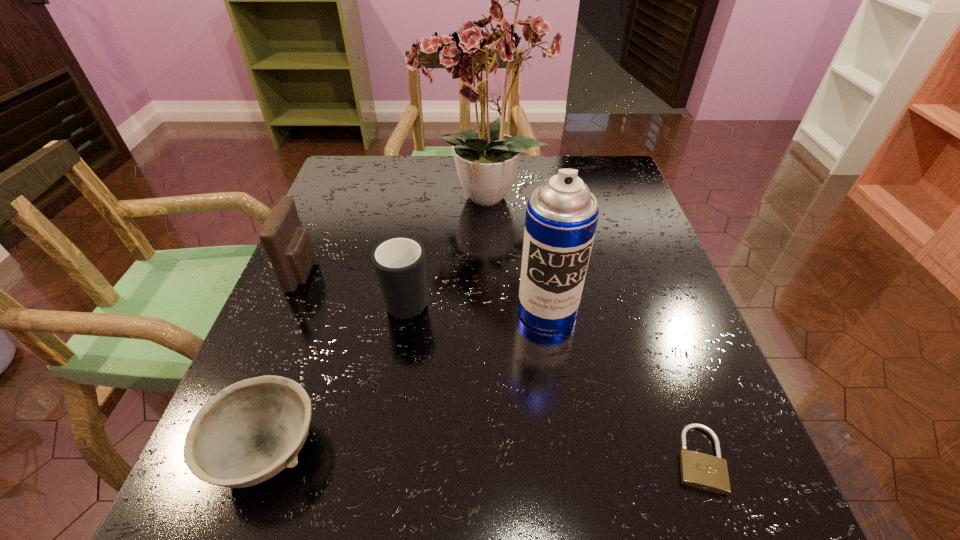
This screenshot has width=960, height=540. Identify the location of vacant area that lies between the padlock and the pouch. (501, 366).

Find the location of `empty location between the second tallest object and the rightmost object`. empty location between the second tallest object and the rightmost object is located at coordinates (622, 384).

Where is `free spot between the farthest object and the second shortest object`? free spot between the farthest object and the second shortest object is located at coordinates (374, 325).

At what (x,y) coordinates should I click in order to perform the action: click on vacant space in between the fifth shortest object and the second shortest object. Please return your answer as a coordinate pair (x, y). This screenshot has height=540, width=960. Looking at the image, I should click on (407, 381).

Locate an element on the screen. Image resolution: width=960 pixels, height=540 pixels. vacant space that's between the flower arrangement and the fifth tallest object is located at coordinates (374, 325).

Find the location of `free point between the padlock and the mug`. free point between the padlock and the mug is located at coordinates (553, 378).

You are a GUI agent. You are given a task and a screenshot of the screen. Output one action in this format:
    pyautogui.click(x=<x>, y=<y>)
    Task: Click on the vacant area between the aerosol can and the bowl
    This screenshot has height=540, width=960.
    Given the screenshot: What is the action you would take?
    pyautogui.click(x=407, y=381)

Identify the location of vacant space in between the flower arrangement and the fifth shortest object. The image size is (960, 540). (514, 255).

This screenshot has width=960, height=540. What are the coordinates of `free space between the mug and the bowl` in the screenshot? It's located at (338, 374).

Identify which object is located as the fourth nearest to the pouch. Please provide its 2D coordinates. Your answer should be formatted as a tuple, i.e. [(x, y)], where the tuple contains the x and y coordinates of a point satisfying the conditions above.

[(561, 218)]